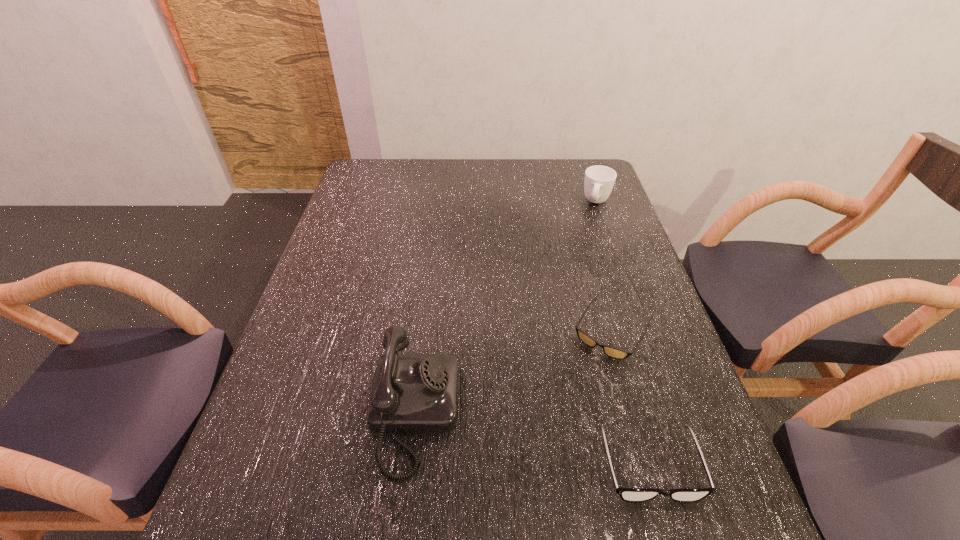
This screenshot has height=540, width=960. I want to click on the leftmost object, so click(411, 393).

Find the location of a particular element. This screenshot has height=540, width=960. telephone is located at coordinates (411, 393).

You are a GUI agent. You are given a task and a screenshot of the screen. Output one action in this format:
    pyautogui.click(x=<x>, y=<y>)
    Task: Click on the spectacles
    
    Given the screenshot: What is the action you would take?
    tap(626, 494)

I want to click on sunglasses, so click(x=610, y=351).

Where is `the third shortest object`? the third shortest object is located at coordinates (599, 180).

The width and height of the screenshot is (960, 540). I want to click on cup, so click(x=599, y=180).

Where is `vacant space located on the dial of the tallest object`? The height and width of the screenshot is (540, 960). vacant space located on the dial of the tallest object is located at coordinates coord(495,413).

Identify the location of free spot located on the front-facing side of the shortest object. This screenshot has width=960, height=540. (555, 426).

Locate an element on the screen. The height and width of the screenshot is (540, 960). free space located 0.050m on the front-facing side of the shortest object is located at coordinates (588, 372).

The height and width of the screenshot is (540, 960). Find the location of `vacant region located 0.160m on the front-facing side of the shortest object`. vacant region located 0.160m on the front-facing side of the shortest object is located at coordinates (565, 408).